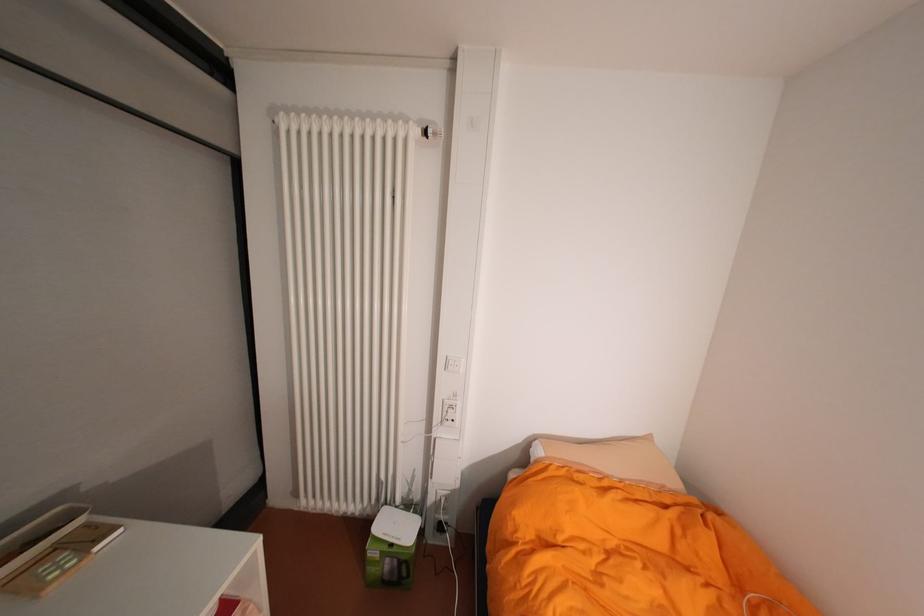
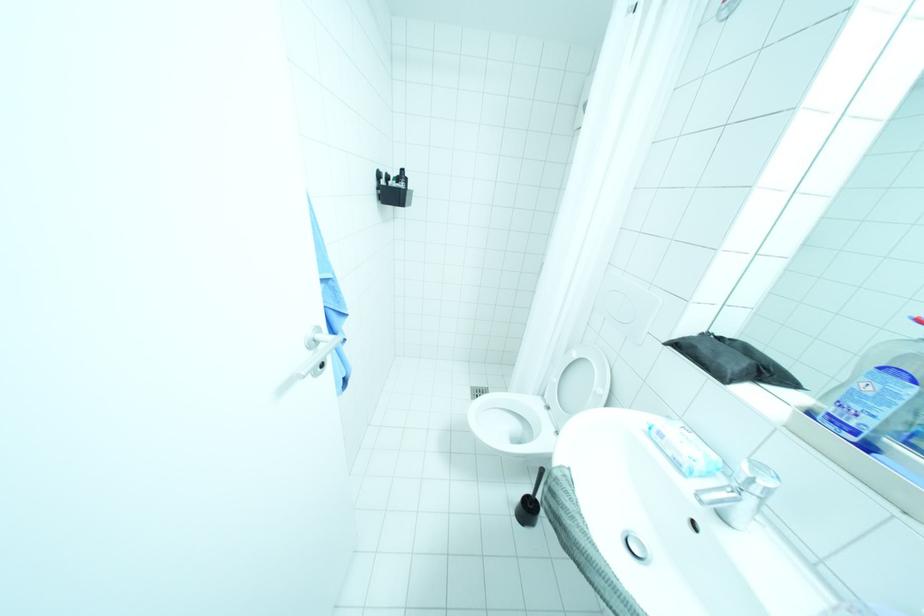
What movement of the cameraman would produce the second image?

The cameraman moved toward right, backward.